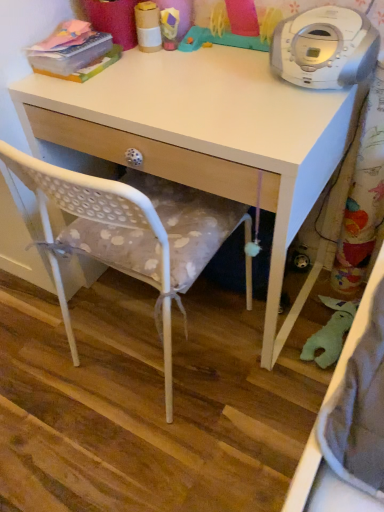
In order to click on free space in front of rubber duck at upper center, which ranks as the 2th toy in left-to-right order in this screenshot , I will do `click(215, 84)`.